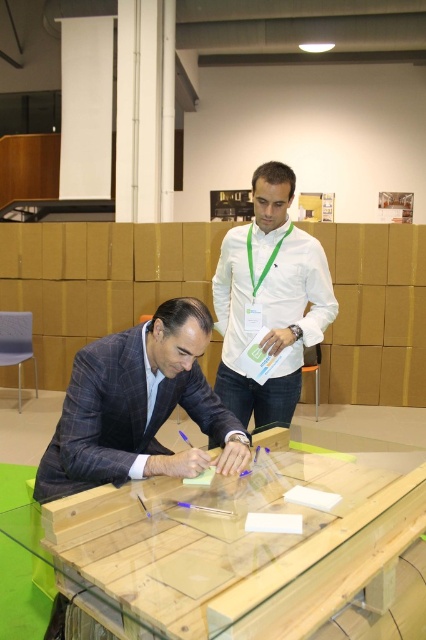
You are standing at the entrance of the conference room and see two points marked on the floor. The first point is at coordinate point (184,541) and the second is at point (230,336). Which point is closer to you?

Point (184,541) is in front of point (230,336), so it is closer to you.